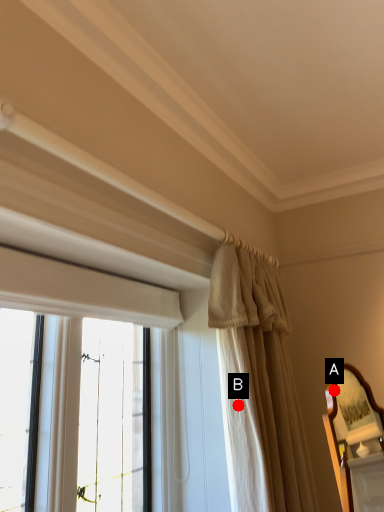
Question: Two points are circled on the image, labeled by A and B beside each circle. Which point is closer to the camera?

Choices:
 (A) A is closer
 (B) B is closer

Answer: (B)